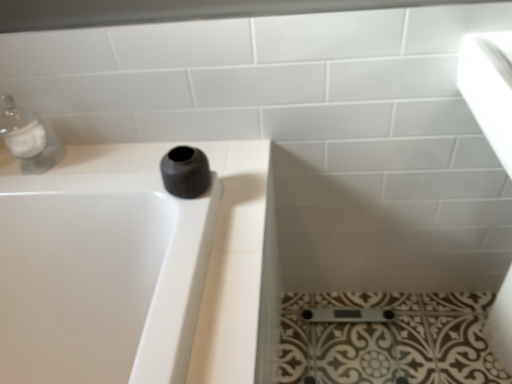
Describe the element at coordinates (134, 271) in the screenshot. I see `white glossy bathtub at upper left` at that location.

Locate an element on the screen. white glossy bathtub at upper left is located at coordinates (134, 271).

Measure the distance between point (42, 225) and camera.

Point (42, 225) is 35.71 inches away from camera.

This screenshot has height=384, width=512. I want to click on white glossy bathtub at upper left, so click(134, 271).